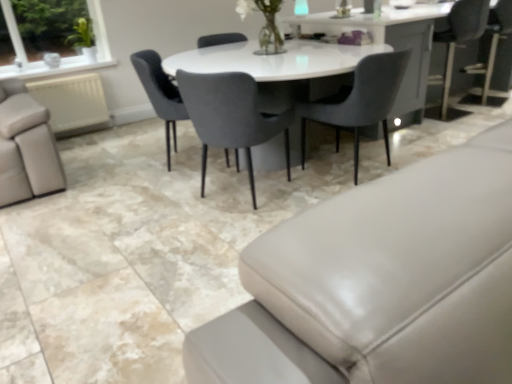
At what (x,y) coordinates should I click in order to perform the action: click on vacant area that lies in front of velvet grey chair at center, acting as the second chair starting from the left. Please return your answer as a coordinate pair (x, y). This screenshot has height=384, width=512. Looking at the image, I should click on (207, 238).